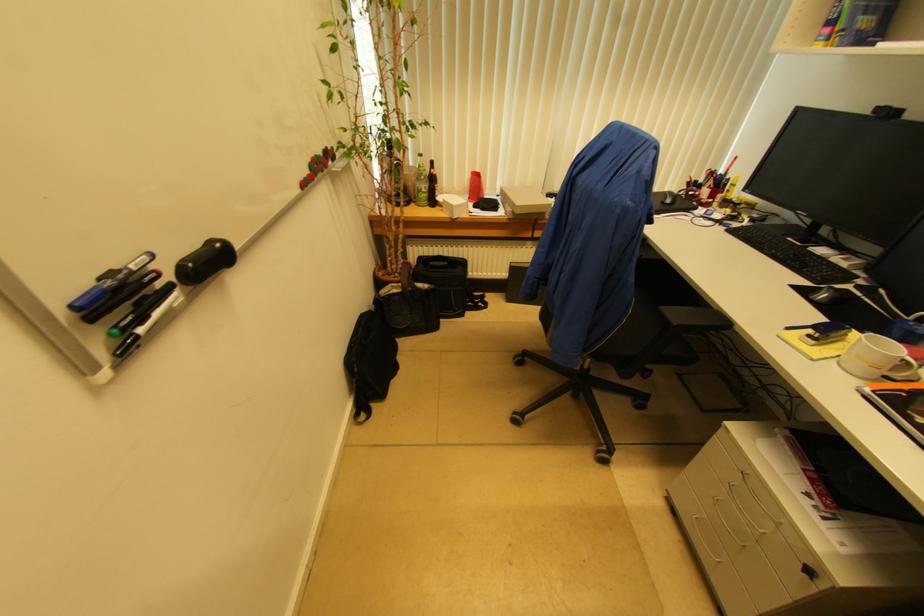
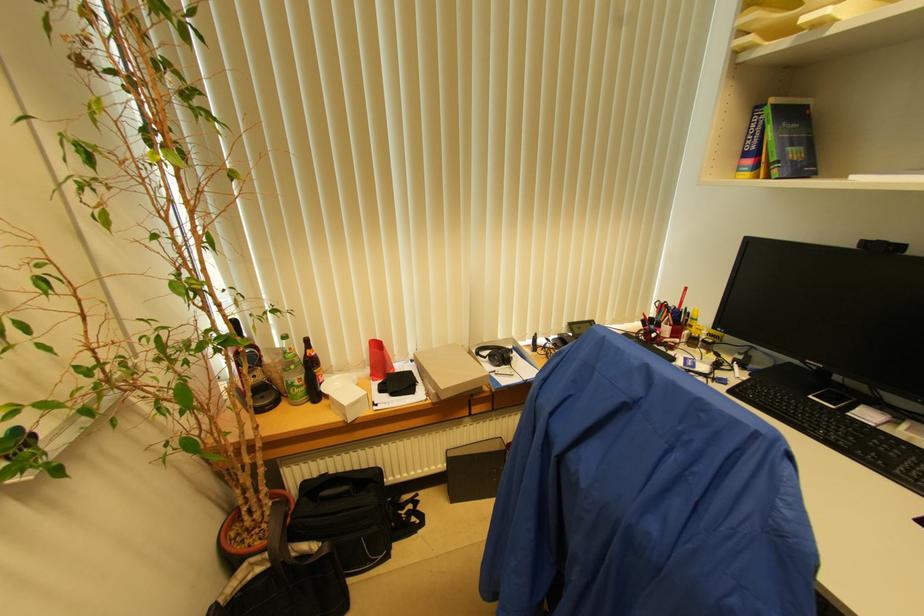
Find the pixel in the second image that matches (429,188) in the first image.

(304, 379)